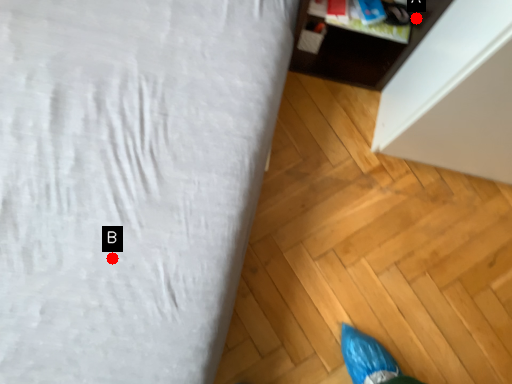
Question: Two points are circled on the image, labeled by A and B beside each circle. Which point is closer to the camera taking this photo?

Choices:
 (A) A is closer
 (B) B is closer

Answer: (B)